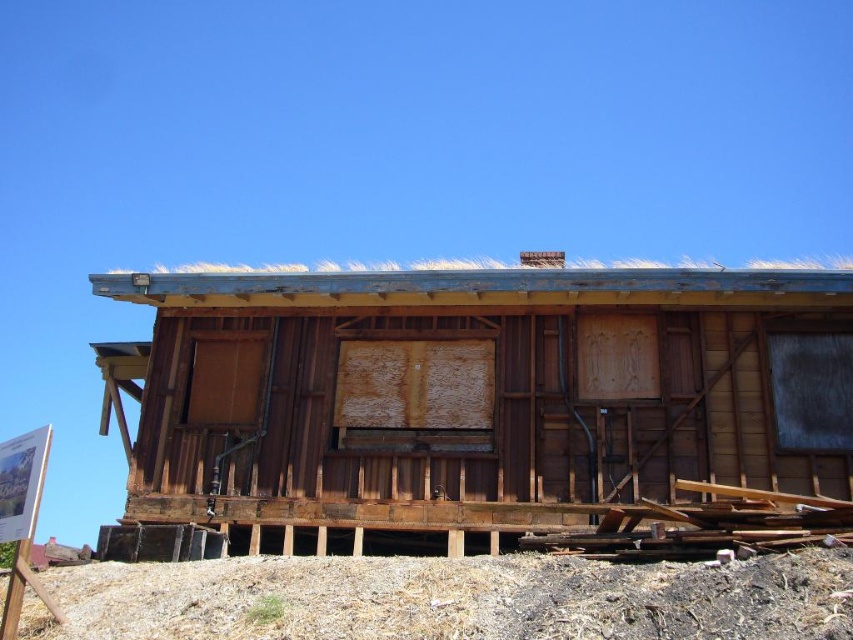
Which is below, wooden at center or brown dirt at lower center?

brown dirt at lower center is below.

Is point (412, 464) farther from viewer compared to point (195, 602)?

Yes, it is.

Is point (422, 406) positioned before point (109, 611)?

No, it is not.

The image size is (853, 640). In order to click on wooden at center in this screenshot , I will do `click(474, 396)`.